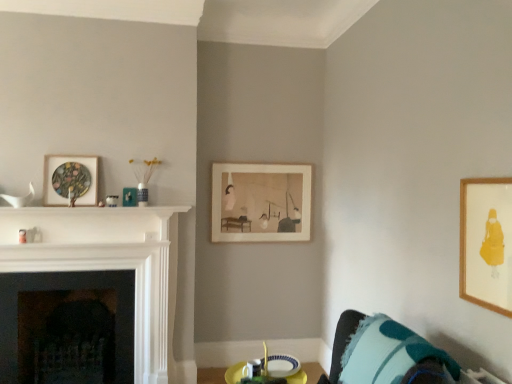
Question: Is point (154, 248) positioned closer to the camera than point (10, 281)?

Choices:
 (A) closer
 (B) farther

Answer: (A)

Question: Do you think white glossy fireplace at left, which ranks as the 1th fireplace in front-to-back order, is within black stone fireplace at left, placed as the 2th fireplace when sorted from front to back, or outside of it?

Choices:
 (A) outside
 (B) inside

Answer: (A)

Question: Estimate the real-world distances between objects in this image. Which object is farther from the black stone fireplace at left, the first fireplace when ordered from back to front?

Choices:
 (A) wooden framed print at upper right, which is counted as the first picture frame, starting from the right
 (B) matte wooden picture frame at upper left, acting as the third picture frame starting from the right
 (C) teal fabric pillow at lower right
 (D) wooden framed artwork at center, the 3th picture frame viewed from the front
 (E) white glossy fireplace at left, which ranks as the 1th fireplace in front-to-back order

Answer: (A)

Question: Which of these objects is positioned closest to the wooden framed print at upper right, which is the third picture frame from back to front?

Choices:
 (A) black stone fireplace at left, placed as the 2th fireplace when sorted from front to back
 (B) teal fabric pillow at lower right
 (C) matte wooden picture frame at upper left, acting as the third picture frame starting from the right
 (D) wooden framed artwork at center, marked as the second picture frame in a right-to-left arrangement
 (E) white glossy fireplace at left, which ranks as the 1th fireplace in front-to-back order

Answer: (B)